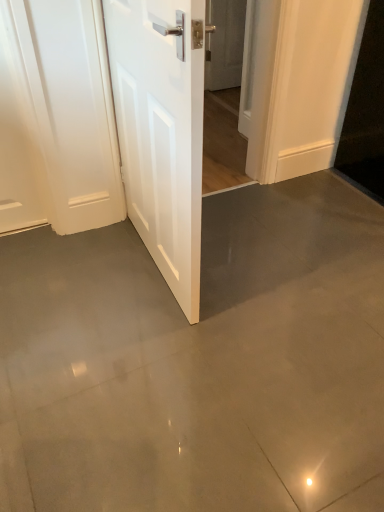
Question: Considering the relative positions of white glossy door at center, which is the 2th door in back-to-front order, and white glossy door at upper center, marked as the second door in a left-to-right arrangement, in the image provided, is white glossy door at center, which is the 2th door in back-to-front order, to the left or to the right of white glossy door at upper center, marked as the second door in a left-to-right arrangement,?

Choices:
 (A) left
 (B) right

Answer: (A)

Question: Is white glossy door at center, which is counted as the first door, starting from the left, taller or shorter than white glossy door at upper center, which is the 2th door from bottom to top?

Choices:
 (A) short
 (B) tall

Answer: (B)

Question: Which is correct: white glossy door at center, which appears as the 2th door when viewed from the right, is inside white glossy door at upper center, which is the 1th door from back to front, or outside of it?

Choices:
 (A) outside
 (B) inside

Answer: (A)

Question: In terms of size, does white glossy door at upper center, which appears as the first door when viewed from the top, appear bigger or smaller than white glossy door at center, positioned as the second door in top-to-bottom order?

Choices:
 (A) big
 (B) small

Answer: (B)

Question: Visually, is white glossy door at upper center, which is the 2th door from bottom to top, positioned to the left or to the right of white glossy door at center, which is the 1th door in front-to-back order?

Choices:
 (A) left
 (B) right

Answer: (B)

Question: Which is correct: white glossy door at upper center, which is the 2th door from bottom to top, is inside white glossy door at center, which appears as the 2th door when viewed from the right, or outside of it?

Choices:
 (A) inside
 (B) outside

Answer: (B)

Question: From the image's perspective, relative to white glossy door at center, which appears as the 2th door when viewed from the right, is white glossy door at upper center, which is the first door from right to left, above or below?

Choices:
 (A) above
 (B) below

Answer: (A)